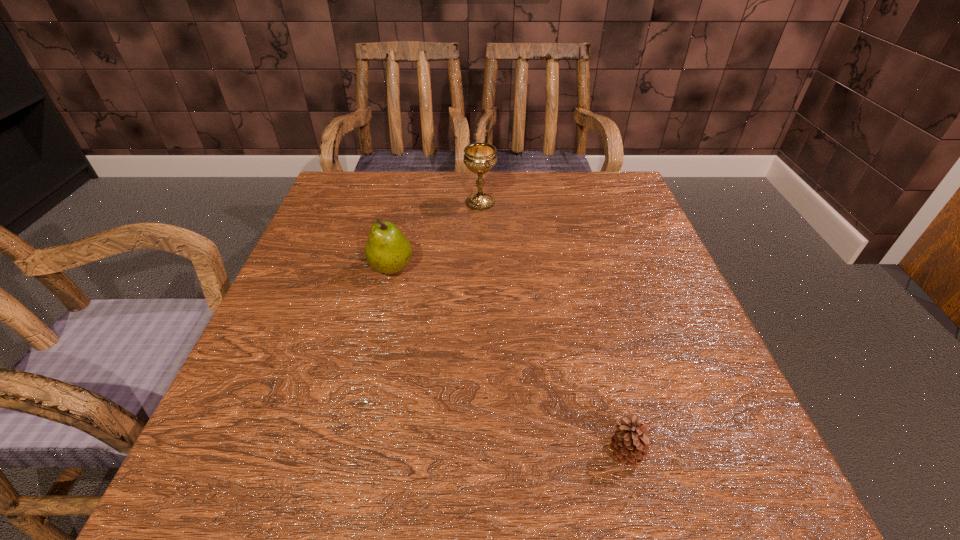
At what (x,y) coordinates should I click in order to perform the action: click on free space at the near right corner of the desktop. Please return your answer as a coordinate pair (x, y). Looking at the image, I should click on (656, 474).

Identify the location of vacant area that lies between the shortest object and the farthest object. This screenshot has height=540, width=960. click(553, 328).

In order to click on empty space between the second object from left to right and the rightmost object in this screenshot , I will do `click(553, 328)`.

You are a GUI agent. You are given a task and a screenshot of the screen. Output one action in this format:
    pyautogui.click(x=<x>, y=<y>)
    Task: Click on the free area in between the second object from left to right and the rightmost object
    
    Given the screenshot: What is the action you would take?
    pyautogui.click(x=553, y=328)

Find the location of a particular element. The height and width of the screenshot is (540, 960). free space between the pinecone and the second farthest object is located at coordinates (509, 360).

I want to click on free space between the pear and the chalice, so click(436, 235).

Find the location of a particular element. The width and height of the screenshot is (960, 540). vacant area that lies between the second object from left to right and the pear is located at coordinates (436, 235).

Find the location of a particular element. vacant space that's between the shortest object and the farthest object is located at coordinates (553, 328).

At what (x,y) coordinates should I click in order to perform the action: click on free space between the chalice and the shortest object. Please return your answer as a coordinate pair (x, y). This screenshot has width=960, height=540. Looking at the image, I should click on (553, 328).

Where is `vacant area between the pear and the farthest object`? vacant area between the pear and the farthest object is located at coordinates (x=436, y=235).